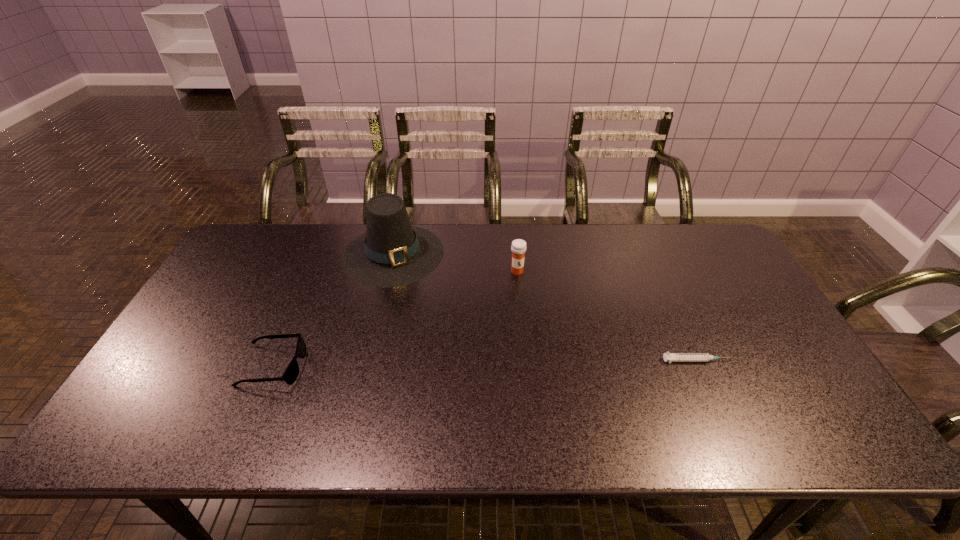
At what (x,y) coordinates should I click in order to perform the action: click on sunglasses. Please return your answer as a coordinate pair (x, y). Looking at the image, I should click on (291, 373).

Where is `the shortest object`? the shortest object is located at coordinates (670, 357).

This screenshot has height=540, width=960. I want to click on the rightmost object, so click(670, 357).

Find the location of a particular element. hat is located at coordinates (392, 253).

In order to click on medicine in this screenshot , I will do `click(518, 247)`.

Image resolution: width=960 pixels, height=540 pixels. I want to click on the third shortest object, so click(518, 247).

This screenshot has width=960, height=540. I want to click on free spot located on the front-facing side of the sunglasses, so coord(421,367).

Identify the location of vacant space located 0.060m at the needle end of the syringe. The image size is (960, 540). click(752, 360).

This screenshot has width=960, height=540. I want to click on vacant space located 0.380m on the front-facing side of the tallest object, so click(430, 387).

Identify the location of vacant space located on the front-facing side of the tallest object. (410, 313).